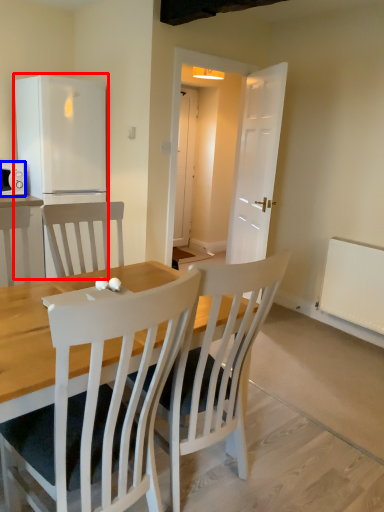
Question: Among these objects, which one is farthest to the camera, refrigerator (highlighted by a red box) or microwave oven (highlighted by a blue box)?

Choices:
 (A) refrigerator
 (B) microwave oven

Answer: (B)